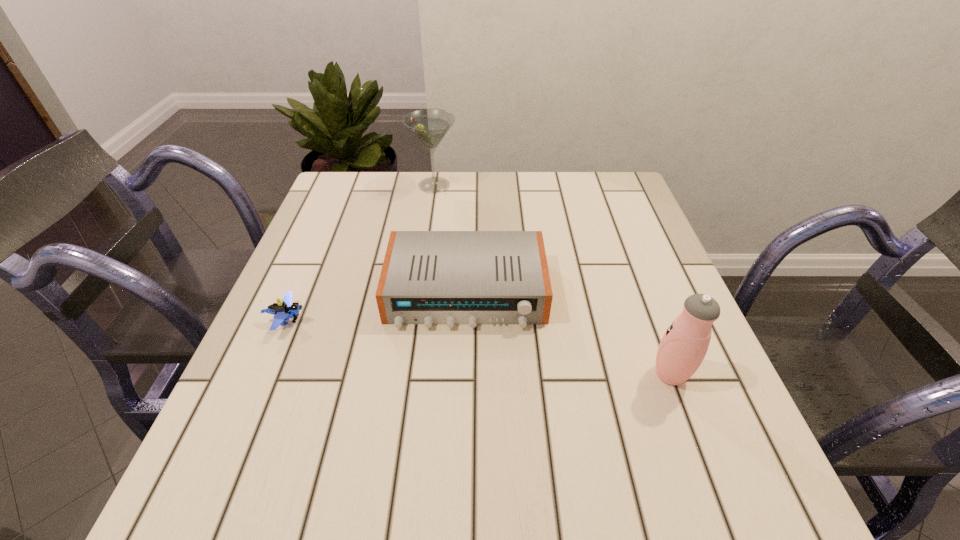
Where is `free region that satisfies the following two spatial constraints: 1. on the front side of the farthest object; 2. on the front-facing side of the shortest object`? free region that satisfies the following two spatial constraints: 1. on the front side of the farthest object; 2. on the front-facing side of the shortest object is located at coordinates (415, 320).

What are the coordinates of `free space in the image that satisfies the following two spatial constraints: 1. on the control panel of the radio receiver; 2. on the front-facing side of the leftmost object` in the screenshot? It's located at (466, 320).

I want to click on blank space that satisfies the following two spatial constraints: 1. on the front side of the martini; 2. on the front-facing side of the shortest object, so click(415, 320).

At what (x,y) coordinates should I click in order to perform the action: click on free location that satisfies the following two spatial constraints: 1. on the front-facing side of the shortest object; 2. on the left side of the nearest object. Please return your answer as a coordinate pair (x, y). The height and width of the screenshot is (540, 960). Looking at the image, I should click on (264, 374).